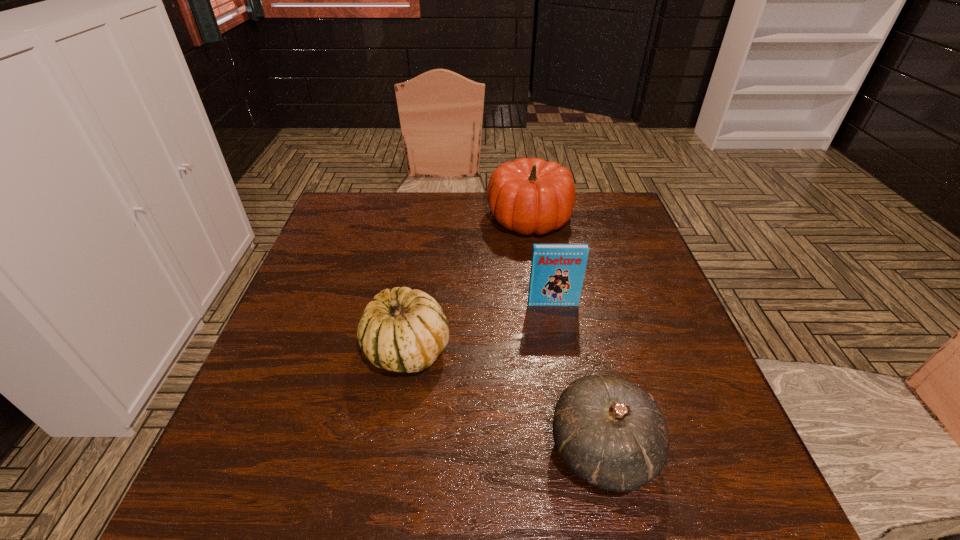
This screenshot has width=960, height=540. I want to click on object that is at the far edge, so click(528, 196).

Where is `object at the near edge`? The image size is (960, 540). object at the near edge is located at coordinates (611, 433).

Locate an element on the screen. object that is at the right edge is located at coordinates (611, 433).

This screenshot has height=540, width=960. Find the location of `object situated at the near right corner`. object situated at the near right corner is located at coordinates (611, 433).

At what (x,y) coordinates should I click in order to perform the action: click on vacant space at the far edge of the desktop. Please return your answer as a coordinate pair (x, y). Looking at the image, I should click on (576, 236).

In the image, there is a desktop. Where is `vacant space at the near edge`? This screenshot has height=540, width=960. vacant space at the near edge is located at coordinates (411, 516).

Locate an element on the screen. The image size is (960, 540). free space at the left edge of the desktop is located at coordinates (309, 311).

The height and width of the screenshot is (540, 960). In order to click on blank space at the right edge of the desktop in this screenshot , I will do `click(703, 453)`.

You are a GUI agent. You are given a task and a screenshot of the screen. Output one action in this format:
    pyautogui.click(x=<x>, y=<y>)
    Task: Click on the vacant space at the far left corner of the desktop
    The height and width of the screenshot is (540, 960).
    Given the screenshot: What is the action you would take?
    pyautogui.click(x=348, y=228)

The width and height of the screenshot is (960, 540). What are the coordinates of `vacant point at the far right corner` in the screenshot? It's located at (586, 207).